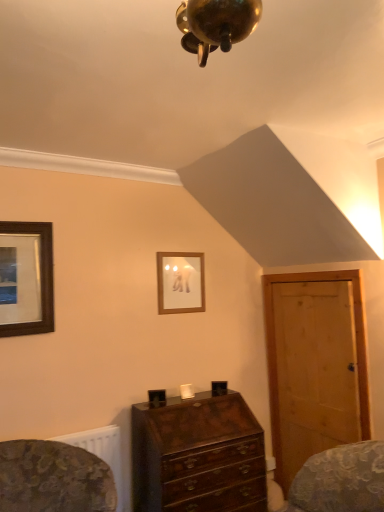
How much space does wooden picture frame at upper center, the second picture frame viewed from the left, occupy horizontally?

The width of wooden picture frame at upper center, the second picture frame viewed from the left, is 2.53 centimeters.

Describe the element at coordinates (26, 278) in the screenshot. I see `wooden framed picture at left, marked as the first picture frame in a left-to-right arrangement` at that location.

Locate an element on the screen. Image resolution: width=384 pixels, height=512 pixels. mahogany wooden chest of drawers at center is located at coordinates (198, 456).

Consider the image. Considering the relative sizes of mahogany wooden chest of drawers at center and light brown wooden door at right in the image provided, is mahogany wooden chest of drawers at center wider than light brown wooden door at right?

Yes, mahogany wooden chest of drawers at center is wider than light brown wooden door at right.

Visually, is mahogany wooden chest of drawers at center positioned to the left or to the right of light brown wooden door at right?

In the image, mahogany wooden chest of drawers at center appears on the left side of light brown wooden door at right.

Which object is further away from the camera taking this photo, mahogany wooden chest of drawers at center or light brown wooden door at right?

light brown wooden door at right.

From their relative heights in the image, would you say mahogany wooden chest of drawers at center is taller or shorter than light brown wooden door at right?

In the image, mahogany wooden chest of drawers at center appears to be shorter than light brown wooden door at right.

Which is in front, wooden picture frame at upper center, the second picture frame viewed from the left, or mahogany wooden chest of drawers at center?

Positioned in front is mahogany wooden chest of drawers at center.

From the image's perspective, does wooden picture frame at upper center, the 1th picture frame viewed from the right, appear higher than mahogany wooden chest of drawers at center?

Yes.

Which picture frame is the 2nd one when counting from the back of the mahogany wooden chest of drawers at center? Please provide its 2D coordinates.

[(180, 282)]

Considering the positions of points (202, 294) and (243, 452), is point (202, 294) farther from camera compared to point (243, 452)?

Yes.

Between light brown wooden door at right and wooden framed picture at left, which appears as the 2th picture frame when viewed from the back, which one has smaller size?

With smaller size is wooden framed picture at left, which appears as the 2th picture frame when viewed from the back.

Considering the points (349, 418) and (46, 308), which point is behind, point (349, 418) or point (46, 308)?

The point (349, 418) is behind.

From the image's perspective, starting from the light brown wooden door at right, which picture frame is the 2nd one above? Please provide its 2D coordinates.

[(26, 278)]

Which object is wider, light brown wooden door at right or wooden framed picture at left, marked as the first picture frame in a left-to-right arrangement?

Wider between the two is wooden framed picture at left, marked as the first picture frame in a left-to-right arrangement.

Is wooden picture frame at upper center, the second picture frame viewed from the left, in contact with light brown wooden door at right?

No, wooden picture frame at upper center, the second picture frame viewed from the left, is not making contact with light brown wooden door at right.

From their relative heights in the image, would you say wooden picture frame at upper center, the second picture frame viewed from the left, is taller or shorter than light brown wooden door at right?

Considering their sizes, wooden picture frame at upper center, the second picture frame viewed from the left, has less height than light brown wooden door at right.

Considering the positions of points (199, 264) and (346, 439), is point (199, 264) closer to camera compared to point (346, 439)?

No, (199, 264) is behind (346, 439).

In the scene shown: Which object is wider, mahogany wooden chest of drawers at center or wooden picture frame at upper center, the 1th picture frame when ordered from back to front?

With larger width is mahogany wooden chest of drawers at center.

Is mahogany wooden chest of drawers at center in contact with wooden picture frame at upper center, the 1th picture frame when ordered from back to front?

mahogany wooden chest of drawers at center and wooden picture frame at upper center, the 1th picture frame when ordered from back to front, are clearly separated.

From the image's perspective, does mahogany wooden chest of drawers at center appear lower than wooden picture frame at upper center, the 1th picture frame viewed from the right?

Yes, from the image's perspective, mahogany wooden chest of drawers at center is below wooden picture frame at upper center, the 1th picture frame viewed from the right.

Is mahogany wooden chest of drawers at center facing away from wooden picture frame at upper center, the 1th picture frame when ordered from back to front?

mahogany wooden chest of drawers at center is not turned away from wooden picture frame at upper center, the 1th picture frame when ordered from back to front.

Is light brown wooden door at right beside mahogany wooden chest of drawers at center?

No, light brown wooden door at right is not in contact with mahogany wooden chest of drawers at center.

Does light brown wooden door at right turn towards mahogany wooden chest of drawers at center?

Yes, light brown wooden door at right faces towards mahogany wooden chest of drawers at center.

Is point (357, 271) positioned behind point (173, 448)?

Yes, it is behind point (173, 448).

In the scene shown: Does light brown wooden door at right have a greater width compared to mahogany wooden chest of drawers at center?

Incorrect, the width of light brown wooden door at right does not surpass that of mahogany wooden chest of drawers at center.

Between point (172, 313) and point (22, 228), which one is positioned behind?

Point (172, 313)

From their relative heights in the image, would you say wooden picture frame at upper center, the second picture frame in the front-to-back sequence, is taller or shorter than wooden framed picture at left, which appears as the 2th picture frame when viewed from the back?

In the image, wooden picture frame at upper center, the second picture frame in the front-to-back sequence, appears to be shorter than wooden framed picture at left, which appears as the 2th picture frame when viewed from the back.

From a real-world perspective, between wooden picture frame at upper center, the 1th picture frame when ordered from back to front, and wooden framed picture at left, which appears as the 2th picture frame when viewed from the back, who is vertically higher?

wooden framed picture at left, which appears as the 2th picture frame when viewed from the back, from a real-world perspective.

Which is more to the right, wooden picture frame at upper center, the second picture frame in the front-to-back sequence, or wooden framed picture at left, which is the 2th picture frame from right to left?

Positioned to the right is wooden picture frame at upper center, the second picture frame in the front-to-back sequence.

In order to click on door located above the mahogany wooden chest of drawers at center (from the image's perspective) in this screenshot , I will do `click(315, 365)`.

Identify the location of picture frame that is the 1st one when counting leftward from the mahogany wooden chest of drawers at center. The width and height of the screenshot is (384, 512). (180, 282).

When comparing their distances from light brown wooden door at right, does wooden framed picture at left, which is the 2th picture frame from right to left, or mahogany wooden chest of drawers at center seem further?

The object further to light brown wooden door at right is wooden framed picture at left, which is the 2th picture frame from right to left.

Looking at the image, which one is located closer to mahogany wooden chest of drawers at center, wooden framed picture at left, marked as the first picture frame in a left-to-right arrangement, or light brown wooden door at right?

The object closer to mahogany wooden chest of drawers at center is light brown wooden door at right.

Estimate the real-world distances between objects in this image. Which object is closer to wooden picture frame at upper center, the second picture frame viewed from the left, wooden framed picture at left, marked as the first picture frame in a left-to-right arrangement, or mahogany wooden chest of drawers at center?

mahogany wooden chest of drawers at center is positioned closer to the anchor wooden picture frame at upper center, the second picture frame viewed from the left.

Considering their positions, is light brown wooden door at right positioned closer to wooden framed picture at left, marked as the first picture frame in a left-to-right arrangement, than mahogany wooden chest of drawers at center?

mahogany wooden chest of drawers at center.

Based on their spatial positions, is wooden picture frame at upper center, the 1th picture frame when ordered from back to front, or light brown wooden door at right further from mahogany wooden chest of drawers at center?

Based on the image, wooden picture frame at upper center, the 1th picture frame when ordered from back to front, appears to be further to mahogany wooden chest of drawers at center.

When comparing their distances from wooden picture frame at upper center, the 1th picture frame when ordered from back to front, does light brown wooden door at right or mahogany wooden chest of drawers at center seem closer?

Based on the image, light brown wooden door at right appears to be nearer to wooden picture frame at upper center, the 1th picture frame when ordered from back to front.

Based on their spatial positions, is light brown wooden door at right or wooden picture frame at upper center, the second picture frame viewed from the left, further from mahogany wooden chest of drawers at center?

wooden picture frame at upper center, the second picture frame viewed from the left, lies further to mahogany wooden chest of drawers at center than the other object.

Consider the image. Estimate the real-world distances between objects in this image. Which object is further from wooden framed picture at left, which appears as the 2th picture frame when viewed from the back, mahogany wooden chest of drawers at center or wooden picture frame at upper center, the 1th picture frame when ordered from back to front?

Among the two, mahogany wooden chest of drawers at center is located further to wooden framed picture at left, which appears as the 2th picture frame when viewed from the back.

This screenshot has height=512, width=384. Find the location of `the chest of drawers situated between wooden framed picture at left, the 1th picture frame from the front, and light brown wooden door at right from left to right`. the chest of drawers situated between wooden framed picture at left, the 1th picture frame from the front, and light brown wooden door at right from left to right is located at coordinates (198, 456).

What are the coordinates of `picture frame between wooden framed picture at left, which is the 2th picture frame from right to left, and light brown wooden door at right` in the screenshot? It's located at (180, 282).

Identify the location of door between wooden picture frame at upper center, the 1th picture frame viewed from the right, and mahogany wooden chest of drawers at center vertically. [x=315, y=365].

The height and width of the screenshot is (512, 384). I want to click on picture frame between wooden framed picture at left, the 1th picture frame from the front, and mahogany wooden chest of drawers at center, in the vertical direction, so click(x=180, y=282).